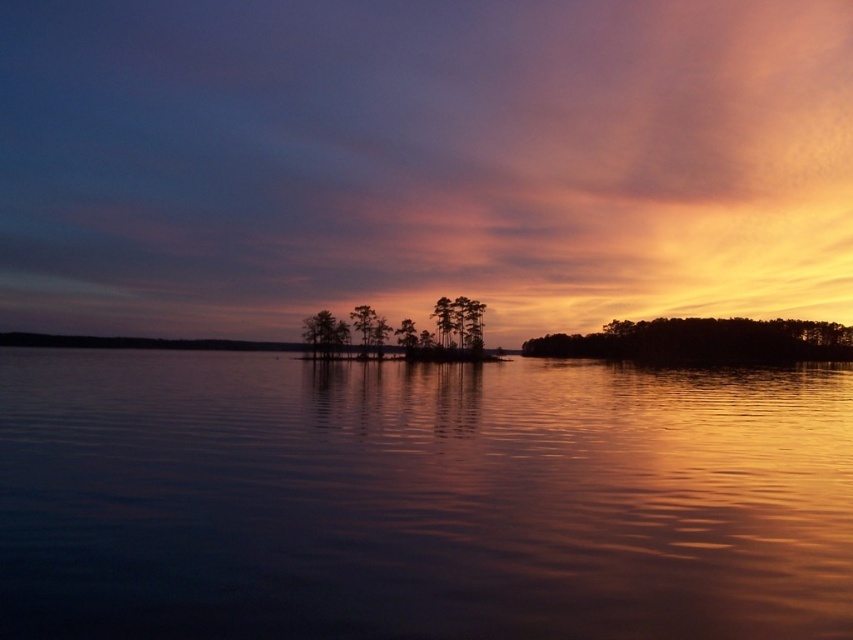
You are an artist trying to paint the sunset scene. You notice the smooth water at center and the silky brown tree at center. Which object should you paint first if you want to follow the rule of painting taller objects before shorter ones?

You should paint the silky brown tree at center first because it is taller than the smooth water at center.